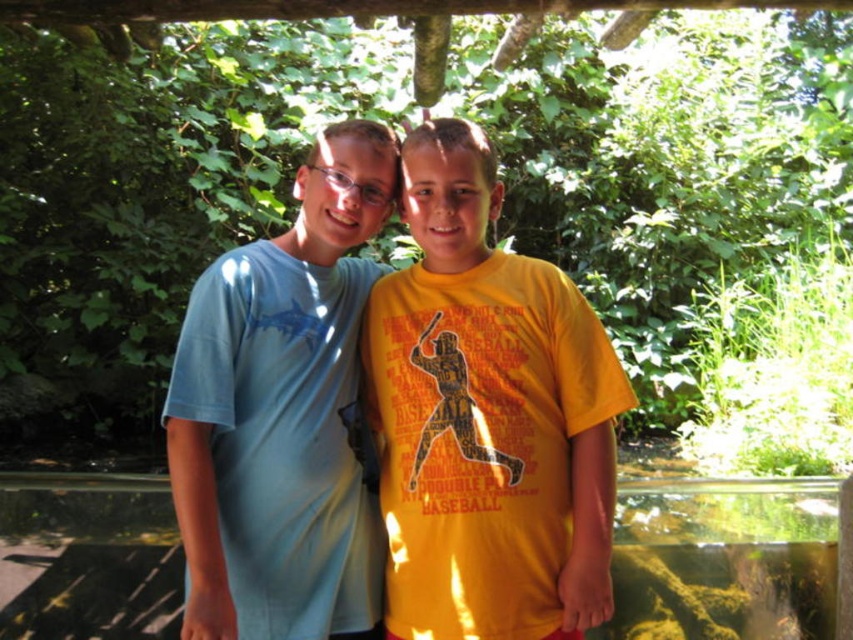
Question: Estimate the real-world distances between objects in this image. Which object is farther from the yellow cotton t-shirt at center?

Choices:
 (A) transparent glass water at center
 (B) light blue cotton shirt at left

Answer: (A)

Question: Based on their relative distances, which object is nearer to the transparent glass water at center?

Choices:
 (A) light blue cotton shirt at left
 (B) yellow cotton t-shirt at center

Answer: (B)

Question: Does yellow cotton t-shirt at center have a smaller size compared to transparent glass water at center?

Choices:
 (A) yes
 (B) no

Answer: (B)

Question: Is yellow cotton t-shirt at center further to camera compared to light blue cotton shirt at left?

Choices:
 (A) yes
 (B) no

Answer: (A)

Question: Which object is closer to the camera taking this photo?

Choices:
 (A) transparent glass water at center
 (B) yellow cotton t-shirt at center

Answer: (B)

Question: Does yellow cotton t-shirt at center appear on the right side of transparent glass water at center?

Choices:
 (A) no
 (B) yes

Answer: (A)